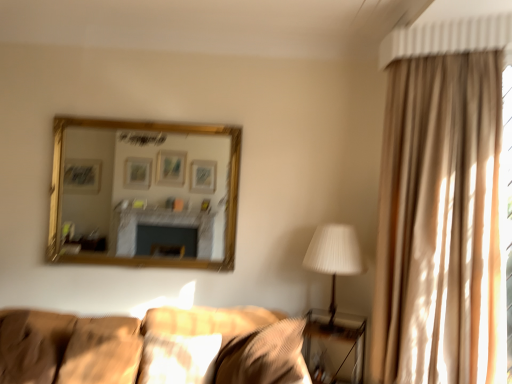
Question: From a real-world perspective, is soft beige pillow at lower left, which ranks as the second pillow in left-to-right order, below beige fabric curtain at right?

Choices:
 (A) yes
 (B) no

Answer: (A)

Question: Does soft beige pillow at lower left, which ranks as the 3th pillow in right-to-left order, come in front of beige fabric curtain at right?

Choices:
 (A) no
 (B) yes

Answer: (A)

Question: Is soft beige pillow at lower left, which ranks as the 3th pillow in right-to-left order, not close to beige fabric curtain at right?

Choices:
 (A) no
 (B) yes

Answer: (B)

Question: Could you tell me if soft beige pillow at lower left, which ranks as the second pillow in left-to-right order, is turned towards beige fabric curtain at right?

Choices:
 (A) yes
 (B) no

Answer: (B)

Question: Would you say soft beige pillow at lower left, which ranks as the 3th pillow in right-to-left order, contains beige fabric curtain at right?

Choices:
 (A) yes
 (B) no

Answer: (B)

Question: From a real-world perspective, is soft beige pillow at lower left, which ranks as the second pillow in left-to-right order, on top of beige fabric curtain at right?

Choices:
 (A) no
 (B) yes

Answer: (A)

Question: Considering the relative sizes of white pleated fabric at right and beige fabric curtain at right in the image provided, is white pleated fabric at right bigger than beige fabric curtain at right?

Choices:
 (A) yes
 (B) no

Answer: (B)

Question: Would you say white pleated fabric at right contains beige fabric curtain at right?

Choices:
 (A) yes
 (B) no

Answer: (B)

Question: Considering the relative sizes of white pleated fabric at right and beige fabric curtain at right in the image provided, is white pleated fabric at right wider than beige fabric curtain at right?

Choices:
 (A) no
 (B) yes

Answer: (B)

Question: From a real-world perspective, is white pleated fabric at right under beige fabric curtain at right?

Choices:
 (A) yes
 (B) no

Answer: (A)

Question: Considering the relative sizes of white pleated fabric at right and beige fabric curtain at right in the image provided, is white pleated fabric at right taller than beige fabric curtain at right?

Choices:
 (A) no
 (B) yes

Answer: (A)

Question: Are white pleated fabric at right and beige fabric curtain at right beside each other?

Choices:
 (A) no
 (B) yes

Answer: (A)

Question: Are suede-like brown pillow at lower left, arranged as the fourth pillow when viewed from the right, and matte beige pillow at center, placed as the second pillow when sorted from right to left, far apart?

Choices:
 (A) yes
 (B) no

Answer: (B)